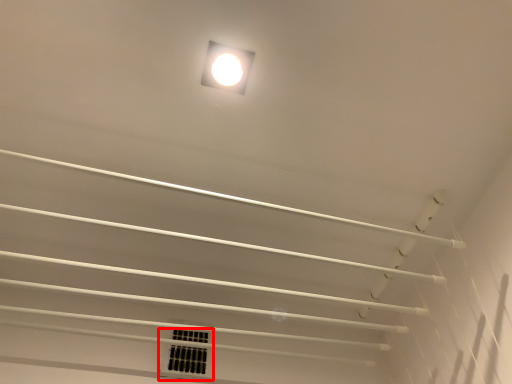
Question: From the image's perspective, where is window (annotated by the red box) located relative to lamp?

Choices:
 (A) below
 (B) above

Answer: (A)